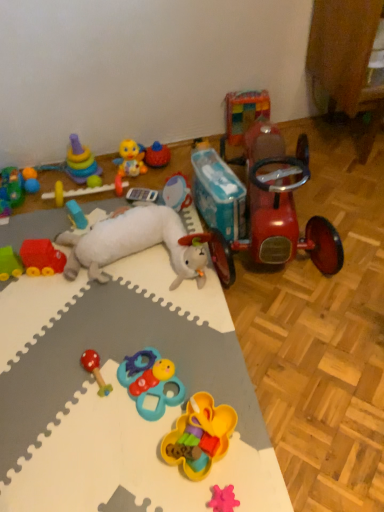
Where is `vacant space that's between wooden/matte rattle at lower left, acting as the fifth toy starting from the left, and white plush toy at center, the seventh toy when ordered from left to right`? vacant space that's between wooden/matte rattle at lower left, acting as the fifth toy starting from the left, and white plush toy at center, the seventh toy when ordered from left to right is located at coordinates (126, 318).